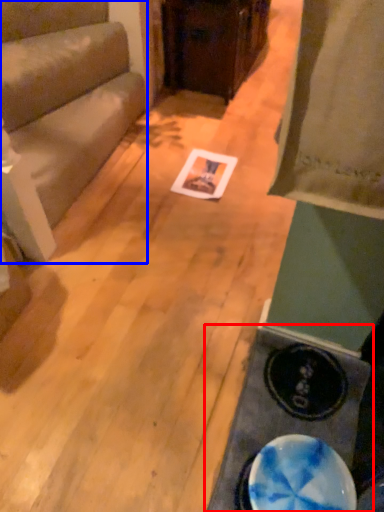
Question: Among these objects, which one is farthest to the camera, table (highlighted by a red box) or furniture (highlighted by a blue box)?

Choices:
 (A) table
 (B) furniture

Answer: (B)